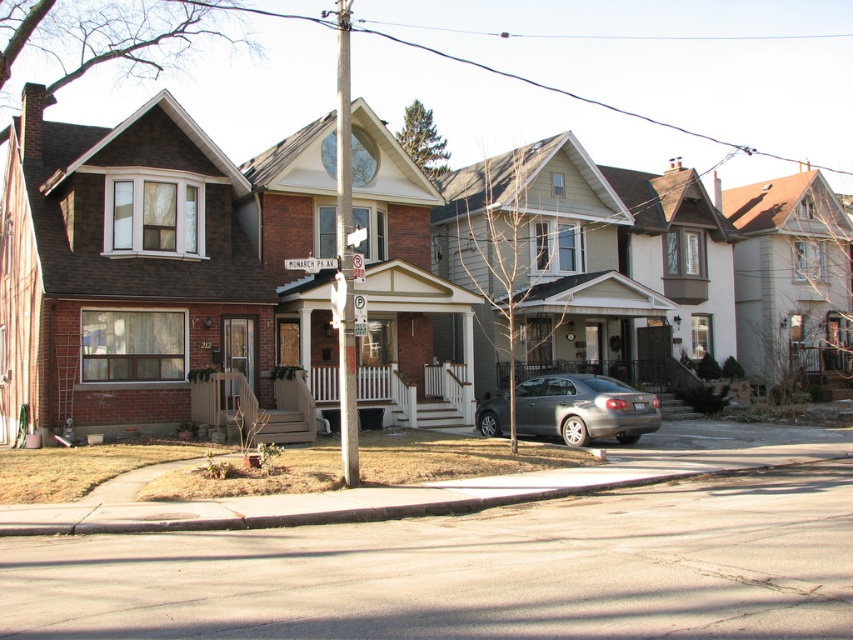
Which is above, brown asphalt curb at lower center or satin silver sedan at center?

Positioned higher is satin silver sedan at center.

Based on the photo, between brown asphalt curb at lower center and satin silver sedan at center, which one is positioned lower?

Positioned lower is brown asphalt curb at lower center.

In order to click on brown asphalt curb at lower center in this screenshot , I will do `click(389, 497)`.

Describe the element at coordinates (583, 408) in the screenshot. I see `satin silver sedan at center` at that location.

Does point (596, 390) come in front of point (308, 266)?

That is True.

In order to click on satin silver sedan at center in this screenshot , I will do `click(583, 408)`.

Which is above, brown asphalt curb at lower center or wooden street sign at center?

wooden street sign at center

Is brown asphalt curb at lower center smaller than wooden street sign at center?

Incorrect, brown asphalt curb at lower center is not smaller in size than wooden street sign at center.

Who is more forward, [195,515] or [289,259]?

Point [195,515]

Locate an element on the screen. The width and height of the screenshot is (853, 640). brown asphalt curb at lower center is located at coordinates (389, 497).